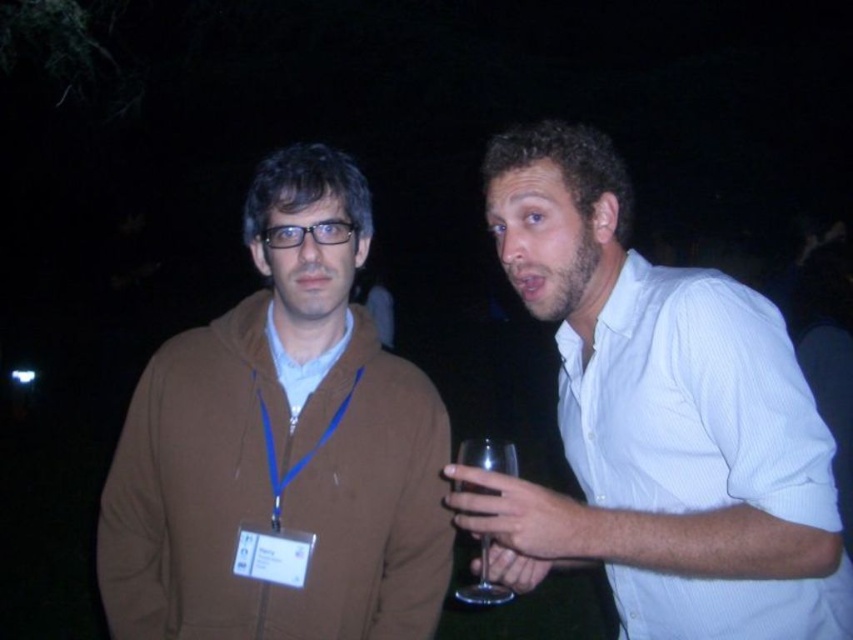
You are a photographer at a formal event. You need to capture a closeup shot of the transparent glass at right and the matte brown shirt at center. Which object will appear bigger in the photo?

The transparent glass at right is larger in size than the matte brown shirt at center, so it will appear bigger in the photo.